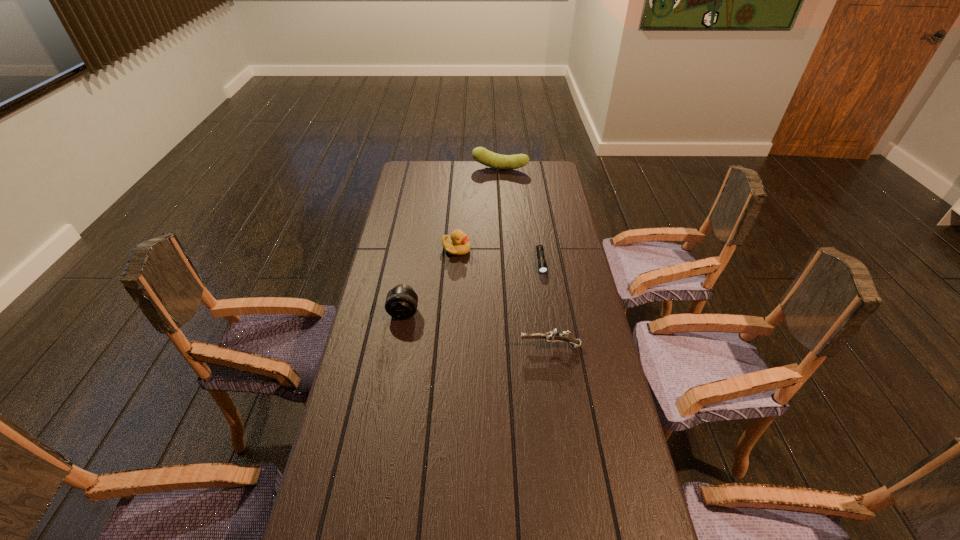
At what (x,y) coordinates should I click in order to perform the action: click on vacant space at the left edge of the desktop. Please return your answer as a coordinate pair (x, y). This screenshot has width=960, height=540. Looking at the image, I should click on (417, 216).

I want to click on vacant space at the right edge of the desktop, so click(563, 197).

Identify the location of free space at the far left corner of the desktop. (407, 170).

Locate an element on the screen. This screenshot has height=540, width=960. free space between the nearest object and the shortest object is located at coordinates (545, 304).

The height and width of the screenshot is (540, 960). In order to click on vacant area that lies between the nearest object and the duckling in this screenshot , I will do `click(503, 298)`.

The width and height of the screenshot is (960, 540). I want to click on unoccupied position between the cucumber and the shortest object, so click(x=520, y=215).

This screenshot has height=540, width=960. Identify the location of free space between the gun and the shortest object. (545, 304).

You are a GUI agent. You are given a task and a screenshot of the screen. Output one action in this format:
    pyautogui.click(x=<x>, y=<y>)
    Task: Click on the free space that is in between the flashlight and the gun
    
    Given the screenshot: What is the action you would take?
    pyautogui.click(x=545, y=304)

This screenshot has height=540, width=960. In order to click on free space between the second nearest object and the shortest object in this screenshot , I will do `click(472, 287)`.

At what (x,y) coordinates should I click in order to perform the action: click on unoccupied position between the nearest object and the cucumber. Please return your answer as a coordinate pair (x, y). Looking at the image, I should click on [525, 258].